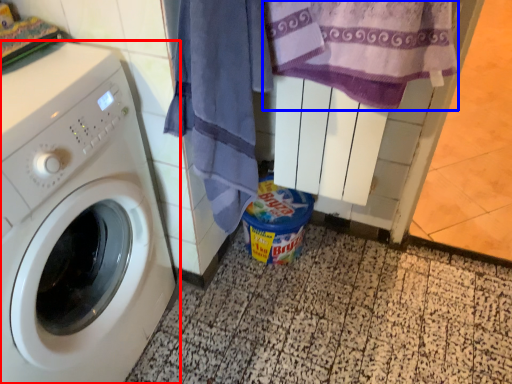
Question: Which object is further to the camera taking this photo, washing machine (highlighted by a red box) or beach towel (highlighted by a blue box)?

Choices:
 (A) washing machine
 (B) beach towel

Answer: (B)